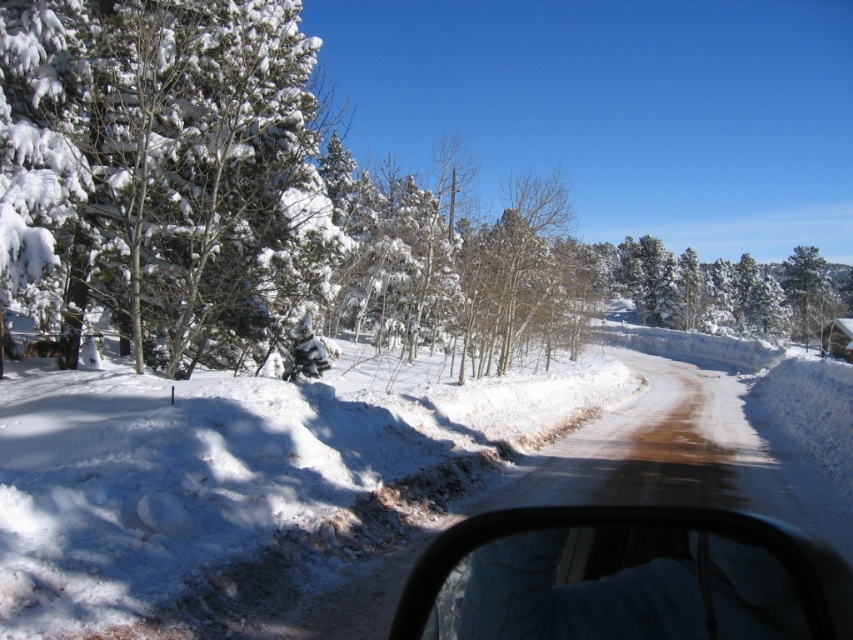
Question: Considering the relative positions of snow-covered pine tree at left and transparent plastic window at center in the image provided, where is snow-covered pine tree at left located with respect to transparent plastic window at center?

Choices:
 (A) left
 (B) right

Answer: (A)

Question: Considering the relative positions of snow-covered pine tree at left and transparent plastic window at center in the image provided, where is snow-covered pine tree at left located with respect to transparent plastic window at center?

Choices:
 (A) right
 (B) left

Answer: (B)

Question: Does snow-covered pine tree at left have a greater width compared to transparent plastic window at center?

Choices:
 (A) yes
 (B) no

Answer: (A)

Question: Which point is closer to the camera?

Choices:
 (A) snow-covered pine tree at left
 (B) transparent plastic window at center

Answer: (B)

Question: Which point is farther to the camera?

Choices:
 (A) snow-covered pine tree at left
 (B) transparent plastic window at center

Answer: (A)